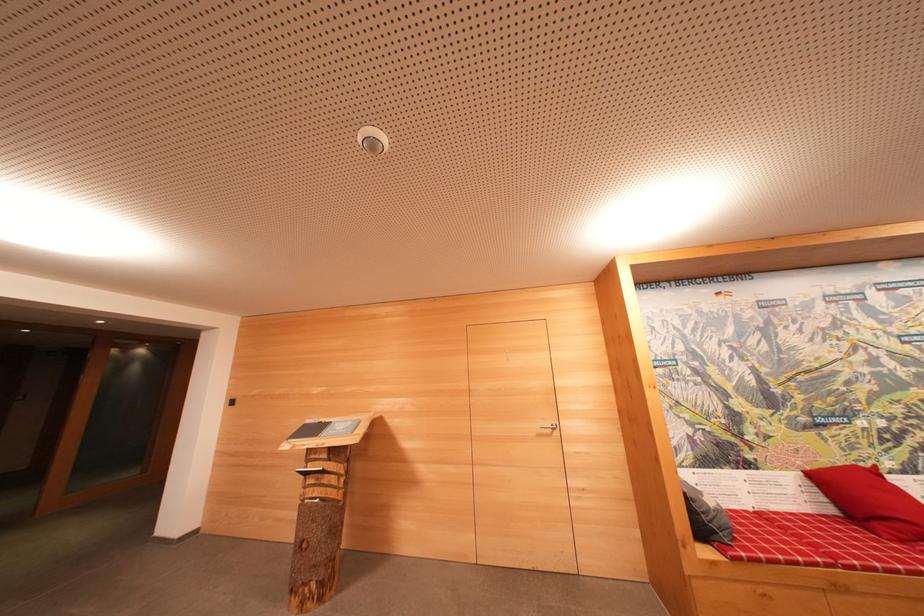
Find the location of `black wall switch`. black wall switch is located at coordinates (232, 402).